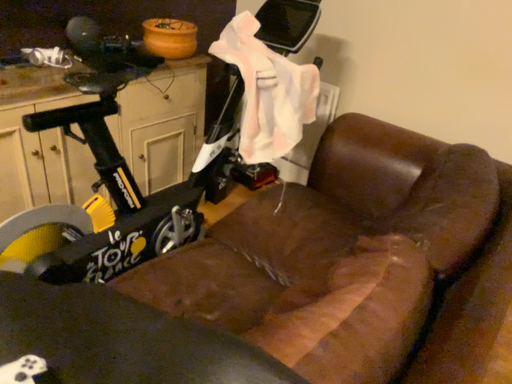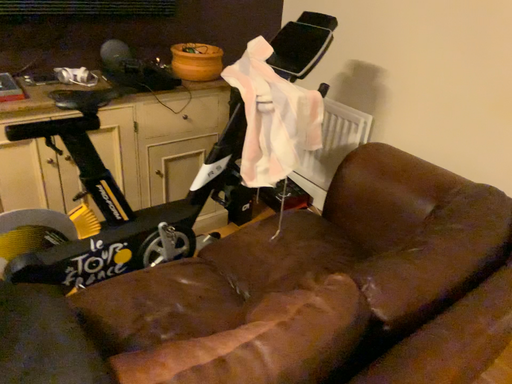
Question: Which way did the camera rotate in the video?

Choices:
 (A) rotated left
 (B) rotated right

Answer: (A)